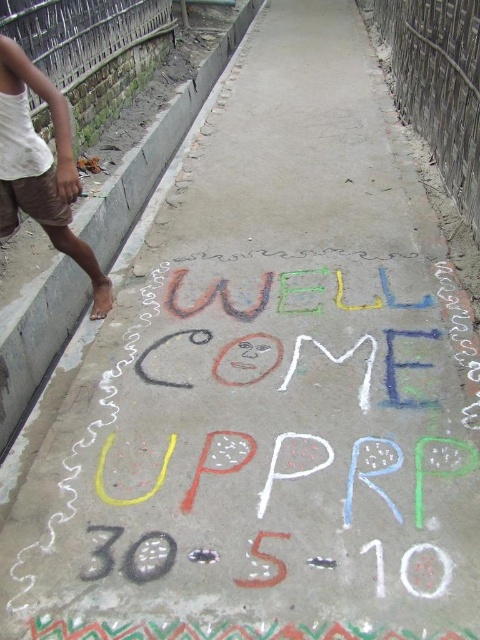
You are standing at point (67, 164) and want to walk to point (32, 346). Is the destination point ahead of you or behind you?

→ The destination point (32, 346) is behind point (67, 164), so the destination is behind you.

You are a delivery person trying to place the brown cotton shorts at left on the gray concrete curb at lower left. Considering the size of the curb, will the shorts fit entirely on it without hanging off the sides?

The gray concrete curb at lower left is wider than the brown cotton shorts at left, so the shorts will fit entirely on the curb without any part hanging off the sides.

You are walking along the narrow concrete pathway and see the gray concrete curb at lower left and the brown cotton shorts at left. Which object is closer to you?

The gray concrete curb at lower left is positioned over the brown cotton shorts at left, meaning it is closer to you.